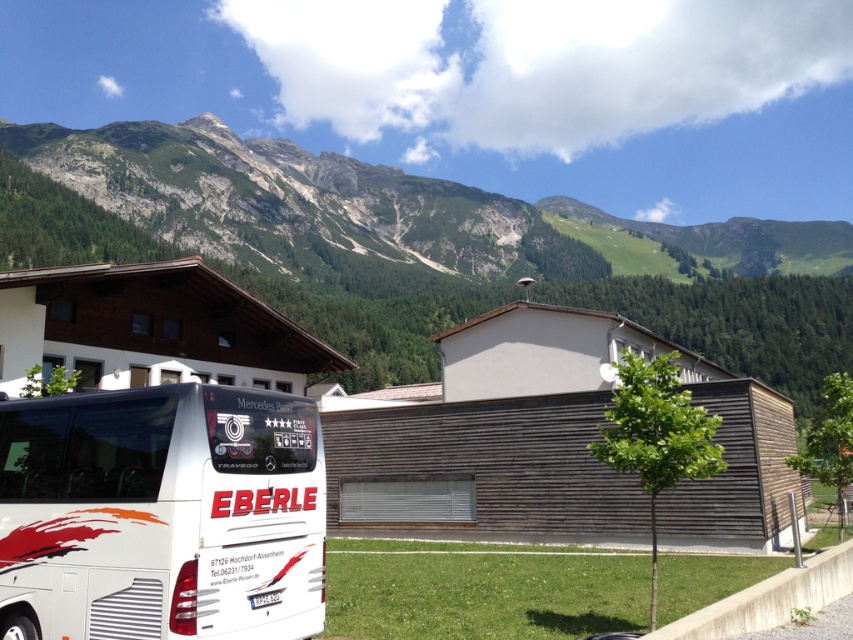
Question: Among these points, which one is farthest from the camera?

Choices:
 (A) (47, 227)
 (B) (86, 588)

Answer: (A)

Question: Can you confirm if green rocky mountain at upper center is bigger than white matte bus at lower left?

Choices:
 (A) no
 (B) yes

Answer: (B)

Question: Is green rocky mountain at upper center positioned in front of white matte bus at lower left?

Choices:
 (A) no
 (B) yes

Answer: (A)

Question: Does green rocky mountain at upper center lie behind white matte bus at lower left?

Choices:
 (A) yes
 (B) no

Answer: (A)